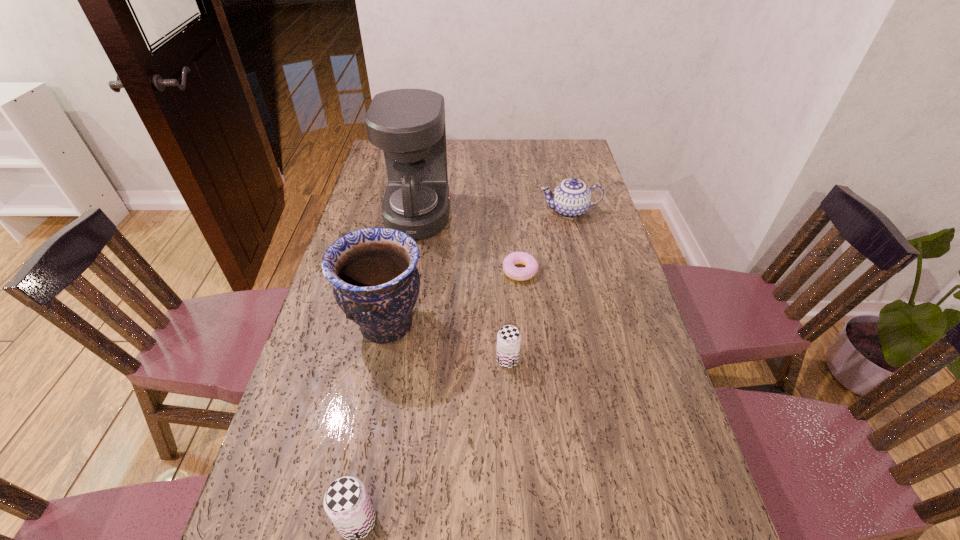
The width and height of the screenshot is (960, 540). Identify the location of free space that satisfies the following two spatial constraints: 1. on the front handle of the shorter beer can; 2. on the right side of the fifth shortest object. (379, 360).

Locate an element on the screen. The width and height of the screenshot is (960, 540). vacant point that satisfies the following two spatial constraints: 1. on the button side of the tallest object; 2. on the back side of the shorter beer can is located at coordinates (394, 360).